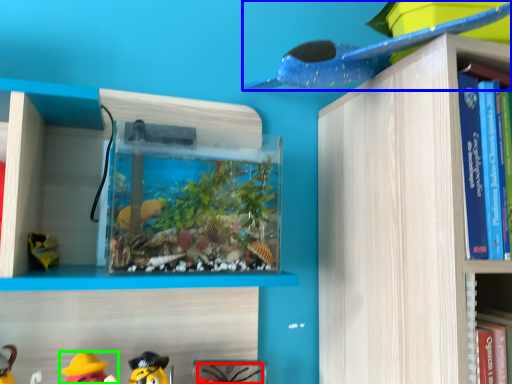
Question: Which is nearer to the toy (highlighted by a red box)? toy (highlighted by a blue box) or toy (highlighted by a green box).

Choices:
 (A) toy
 (B) toy

Answer: (B)